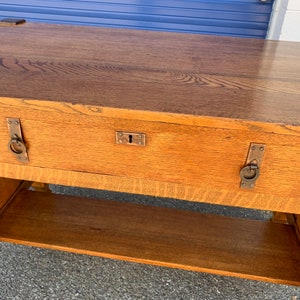
What are the coordinates of `nice gey floor` in the screenshot? It's located at (173, 202).